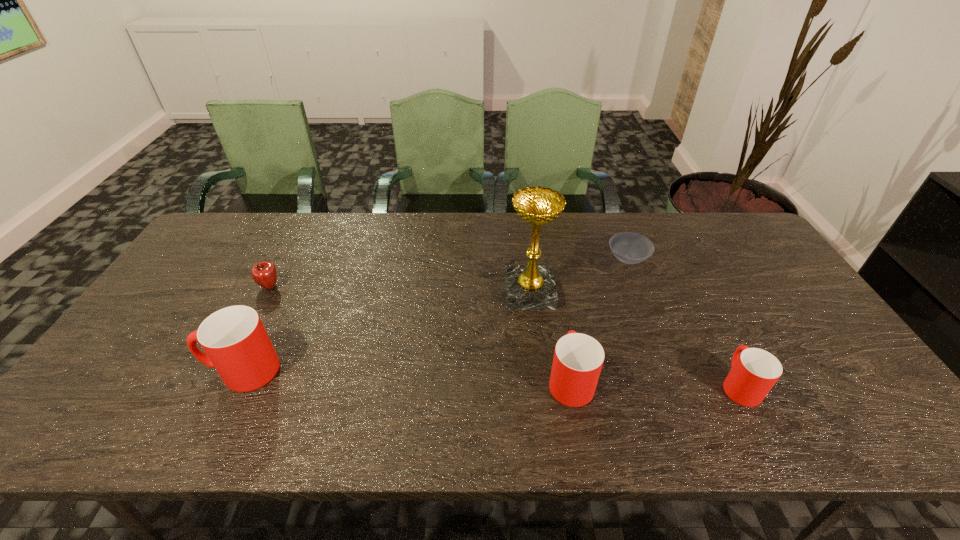
You are a GUI agent. You are given a task and a screenshot of the screen. Output one action in this format:
    pyautogui.click(x=<x>, y=<y>)
    Task: Click on the free region located on the front-facing side of the award
    
    Given the screenshot: What is the action you would take?
    pyautogui.click(x=471, y=293)

Where is `free region located 0.110m on the front-facing side of the award`? The height and width of the screenshot is (540, 960). free region located 0.110m on the front-facing side of the award is located at coordinates (468, 293).

Locate an element on the screen. free space located on the front-facing side of the award is located at coordinates (462, 293).

The image size is (960, 540). What are the coordinates of `free space located on the left of the second shortest object` in the screenshot? It's located at (242, 287).

Where is `object positioned at the far edge`? object positioned at the far edge is located at coordinates (631, 248).

This screenshot has width=960, height=540. I want to click on vacant region at the far edge of the desktop, so click(x=492, y=228).

The height and width of the screenshot is (540, 960). In the image, there is a desktop. In order to click on vacant area at the left edge in this screenshot , I will do click(x=171, y=296).

The image size is (960, 540). Find the location of `free space at the far left corner`. free space at the far left corner is located at coordinates (228, 214).

You are a GUI agent. You are given a task and a screenshot of the screen. Output one action in this format:
    pyautogui.click(x=<x>, y=<y>)
    Task: Click on the free space at the far right corner of the desktop
    Image resolution: width=960 pixels, height=540 pixels.
    Given the screenshot: What is the action you would take?
    pyautogui.click(x=705, y=215)

Locate an element on the screen. free area in between the shortest object and the award is located at coordinates (579, 276).